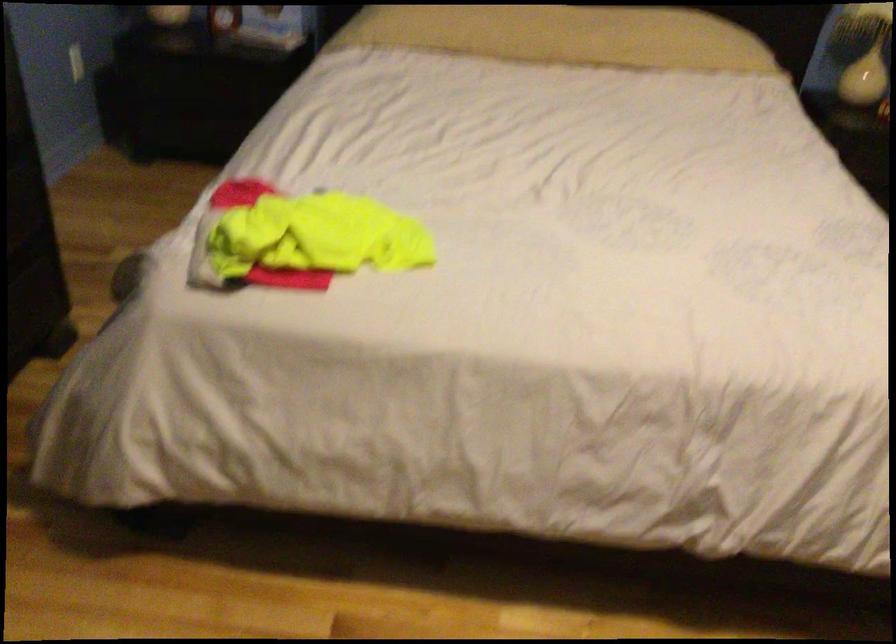
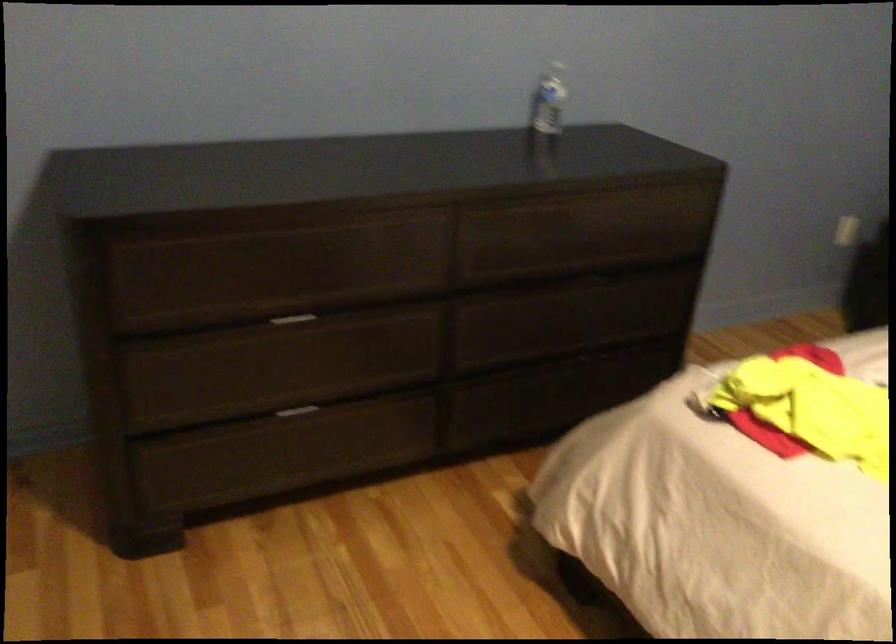
The point at (75, 86) is marked in the first image. Where is the corresponding point in the second image?

(848, 231)